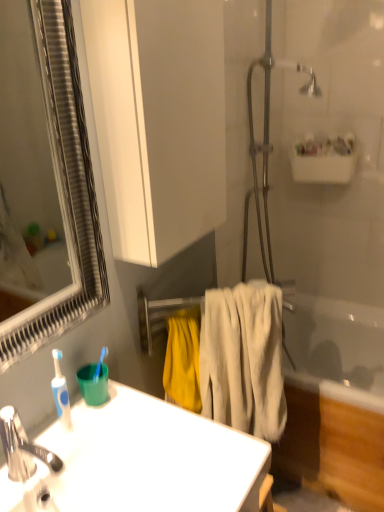
Question: Should I look upward or downward to see white matte cabinet at upper center?

Choices:
 (A) up
 (B) down

Answer: (A)

Question: Is metallic silver towel rack at center outside of white glossy sink at lower left?

Choices:
 (A) no
 (B) yes

Answer: (B)

Question: From a real-world perspective, does metallic silver towel rack at center stand above white glossy sink at lower left?

Choices:
 (A) yes
 (B) no

Answer: (A)

Question: Does metallic silver towel rack at center have a greater height compared to white glossy sink at lower left?

Choices:
 (A) yes
 (B) no

Answer: (A)

Question: Is metallic silver towel rack at center surrounding white glossy sink at lower left?

Choices:
 (A) no
 (B) yes

Answer: (A)

Question: From the image's perspective, does metallic silver towel rack at center appear lower than white glossy sink at lower left?

Choices:
 (A) yes
 (B) no

Answer: (B)

Question: Is metallic silver towel rack at center smaller than white glossy sink at lower left?

Choices:
 (A) no
 (B) yes

Answer: (B)

Question: Is white glossy sink at lower left directly adjacent to silver-framed mirror at left?

Choices:
 (A) no
 (B) yes

Answer: (A)

Question: Does white glossy sink at lower left have a greater width compared to silver-framed mirror at left?

Choices:
 (A) no
 (B) yes

Answer: (B)

Question: From the image's perspective, is white glossy sink at lower left below silver-framed mirror at left?

Choices:
 (A) yes
 (B) no

Answer: (A)

Question: Considering the relative positions of white glossy sink at lower left and silver-framed mirror at left in the image provided, is white glossy sink at lower left to the left of silver-framed mirror at left from the viewer's perspective?

Choices:
 (A) yes
 (B) no

Answer: (B)

Question: Considering the relative sizes of white glossy sink at lower left and silver-framed mirror at left in the image provided, is white glossy sink at lower left taller than silver-framed mirror at left?

Choices:
 (A) yes
 (B) no

Answer: (B)

Question: Can you confirm if white glossy sink at lower left is smaller than silver-framed mirror at left?

Choices:
 (A) yes
 (B) no

Answer: (B)

Question: Is silver-framed mirror at left turned away from metallic silver towel rack at center?

Choices:
 (A) no
 (B) yes

Answer: (A)